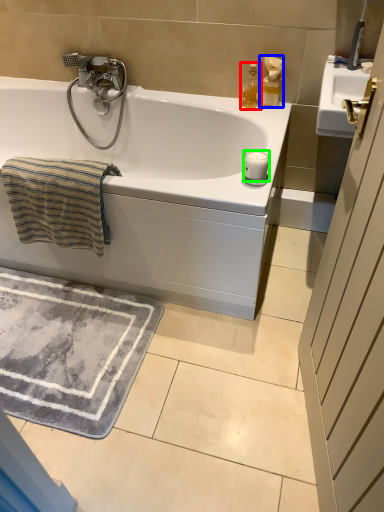
Question: Which is nearer to the soap dispenser (highlighted by a red box)? soap dispenser (highlighted by a blue box) or candle (highlighted by a green box).

Choices:
 (A) soap dispenser
 (B) candle

Answer: (A)